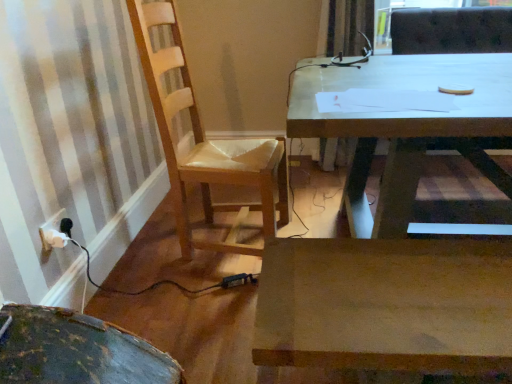
Question: Is white plastic electrical outlet at lower left not near wooden chair at left?

Choices:
 (A) yes
 (B) no

Answer: (B)

Question: Is white plastic electrical outlet at lower left wider than wooden chair at left?

Choices:
 (A) yes
 (B) no

Answer: (B)

Question: Is the surface of white plastic electrical outlet at lower left in direct contact with wooden chair at left?

Choices:
 (A) yes
 (B) no

Answer: (B)

Question: Is white plastic electrical outlet at lower left closer to camera compared to wooden chair at left?

Choices:
 (A) no
 (B) yes

Answer: (A)

Question: Considering the relative sizes of white plastic electrical outlet at lower left and wooden chair at left in the image provided, is white plastic electrical outlet at lower left thinner than wooden chair at left?

Choices:
 (A) no
 (B) yes

Answer: (B)

Question: From a real-world perspective, is white plastic electrical outlet at lower left physically located above or below wooden chair at left?

Choices:
 (A) above
 (B) below

Answer: (B)

Question: Considering the relative positions of white plastic electrical outlet at lower left and wooden chair at left in the image provided, is white plastic electrical outlet at lower left to the left or to the right of wooden chair at left?

Choices:
 (A) right
 (B) left

Answer: (B)

Question: Choose the correct answer: Is white plastic electrical outlet at lower left inside wooden chair at left or outside it?

Choices:
 (A) inside
 (B) outside

Answer: (B)

Question: Relative to wooden chair at left, is white plastic electrical outlet at lower left in front or behind?

Choices:
 (A) behind
 (B) front

Answer: (A)

Question: From a real-world perspective, is wooden chair at left above or below wooden desk at center?

Choices:
 (A) above
 (B) below

Answer: (A)

Question: Is wooden chair at left taller or shorter than wooden desk at center?

Choices:
 (A) tall
 (B) short

Answer: (A)

Question: Considering their positions, is wooden chair at left located in front of or behind wooden desk at center?

Choices:
 (A) front
 (B) behind

Answer: (B)

Question: Visually, is wooden chair at left positioned to the left or to the right of wooden desk at center?

Choices:
 (A) right
 (B) left

Answer: (B)

Question: Is wooden desk at center inside or outside of wooden chair at left?

Choices:
 (A) inside
 (B) outside

Answer: (B)

Question: Is point (371, 132) closer or farther from the camera than point (159, 100)?

Choices:
 (A) farther
 (B) closer

Answer: (B)